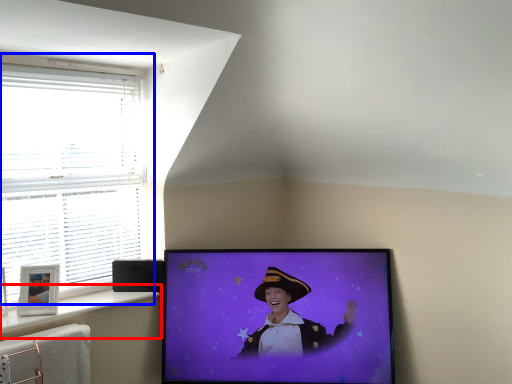
Question: Which point is closer to the camera, window sill (highlighted by a red box) or window (highlighted by a blue box)?

Choices:
 (A) window sill
 (B) window

Answer: (A)